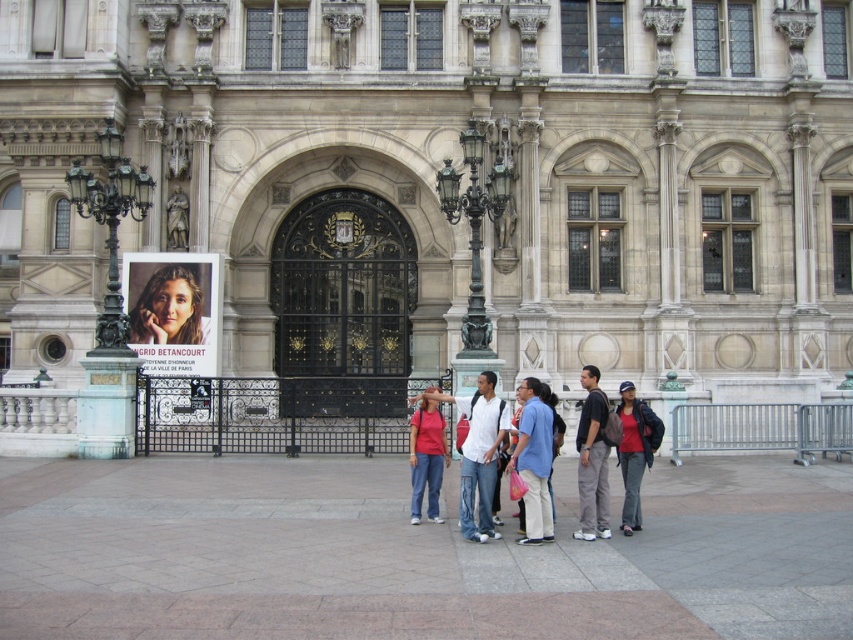
You are standing in front of the ornate building and want to read the matte paper poster at center. Based on the given coordinates, where should you look to find the poster?

The matte paper poster at center is located at the coordinates point (173, 310), so you should look towards the center of the image slightly to the right and lower middle area to find it.

In the scene shown: You are a photographer taking a picture of the historical building. You notice two people wearing a matte red shirt at center and a light blue shirt at center. Which shirt is positioned lower in the photo?

The matte red shirt at center is located below the light blue shirt at center, so it is positioned lower in the photo.